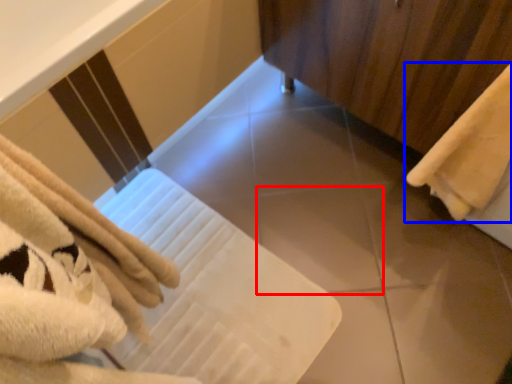
Question: Which object is further to the camera taking this photo, tile (highlighted by a red box) or towel (highlighted by a blue box)?

Choices:
 (A) tile
 (B) towel

Answer: (A)